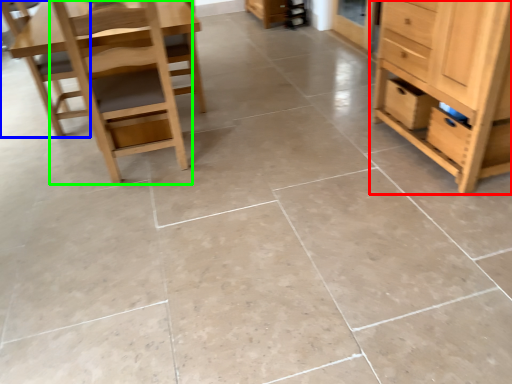
Question: Considering the real-world distances, which object is closest to chest of drawers (highlighted by a red box)? chair (highlighted by a blue box) or chair (highlighted by a green box).

Choices:
 (A) chair
 (B) chair

Answer: (B)